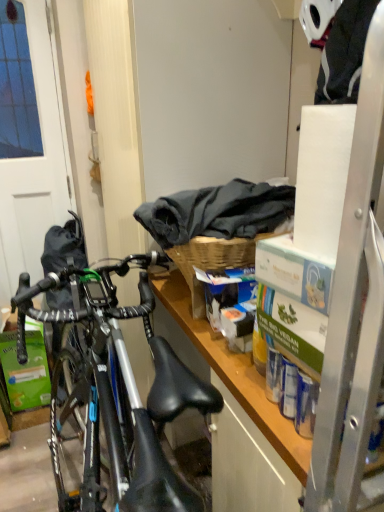
Question: Is point (31, 154) positioned closer to the camera than point (193, 279)?

Choices:
 (A) farther
 (B) closer

Answer: (A)

Question: In the image, is matte white screen door at left on the left side or the right side of woven wood picnic basket at center?

Choices:
 (A) right
 (B) left

Answer: (B)

Question: Which object is the farthest from the wooden shelf at center?

Choices:
 (A) green cardboard box at lower left
 (B) woven wood picnic basket at center
 (C) dark gray fabric at upper center
 (D) matte white screen door at left

Answer: (D)

Question: Based on their relative distances, which object is nearer to the woven wood picnic basket at center?

Choices:
 (A) green cardboard box at lower left
 (B) dark gray fabric at upper center
 (C) matte white screen door at left
 (D) wooden shelf at center

Answer: (B)